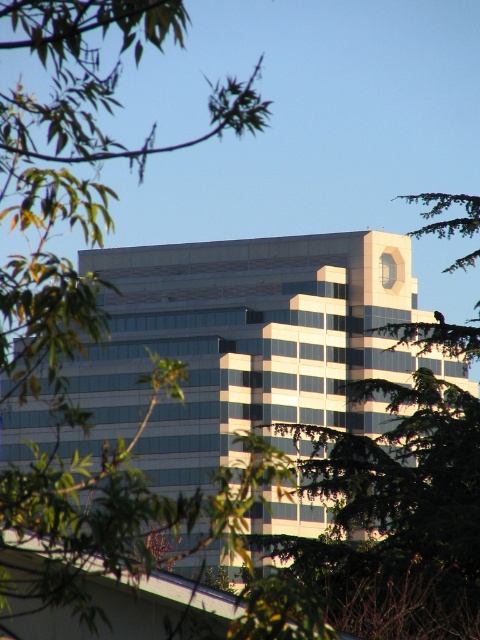
You are an architect reviewing a cityscape design. You notice the white glass building at center and the green leafy tree at upper left. Based on the scene, which object is closer to the viewer?

The white glass building at center is closer to the viewer because the green leafy tree at upper left is behind it.